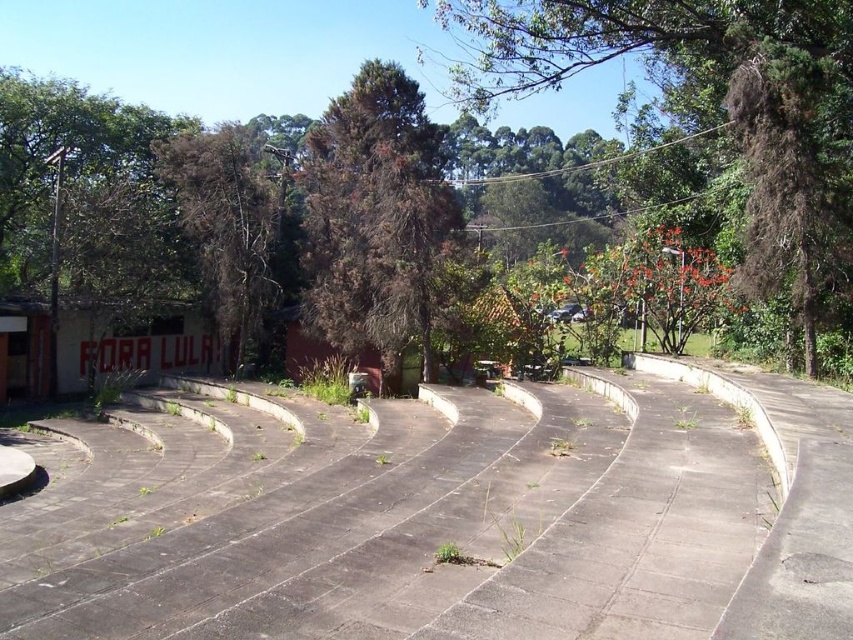
Question: Is brown/dry leaves at left wider than red painted concrete amphitheater at lower left?

Choices:
 (A) yes
 (B) no

Answer: (A)

Question: Which object appears closest to the camera in this image?

Choices:
 (A) red painted concrete amphitheater at lower left
 (B) brown/dry leaves at left

Answer: (A)

Question: Which of the following is the farthest from the observer?

Choices:
 (A) red painted concrete amphitheater at lower left
 (B) brown/dry leaves at left
 (C) green leafy tree at upper center
 (D) brown/dry leaves tree at center

Answer: (B)

Question: Which of the following is the farthest from the observer?

Choices:
 (A) brown/dry leaves tree at center
 (B) green leafy tree at upper center

Answer: (A)

Question: Can you confirm if green leafy tree at upper center is smaller than red painted concrete amphitheater at lower left?

Choices:
 (A) yes
 (B) no

Answer: (B)

Question: Can you confirm if green leafy tree at upper center is positioned to the left of brown/dry leaves tree at center?

Choices:
 (A) yes
 (B) no

Answer: (B)